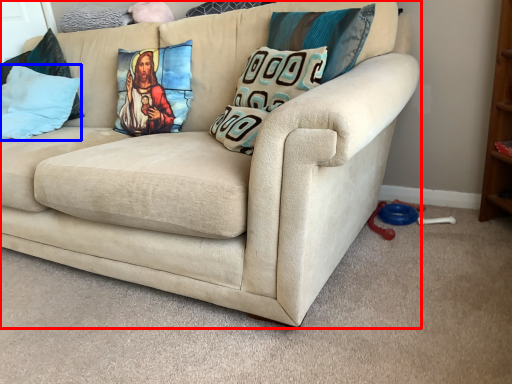
Question: Which object appears farthest to the camera in this image, studio couch (highlighted by a red box) or pillow (highlighted by a blue box)?

Choices:
 (A) studio couch
 (B) pillow

Answer: (B)